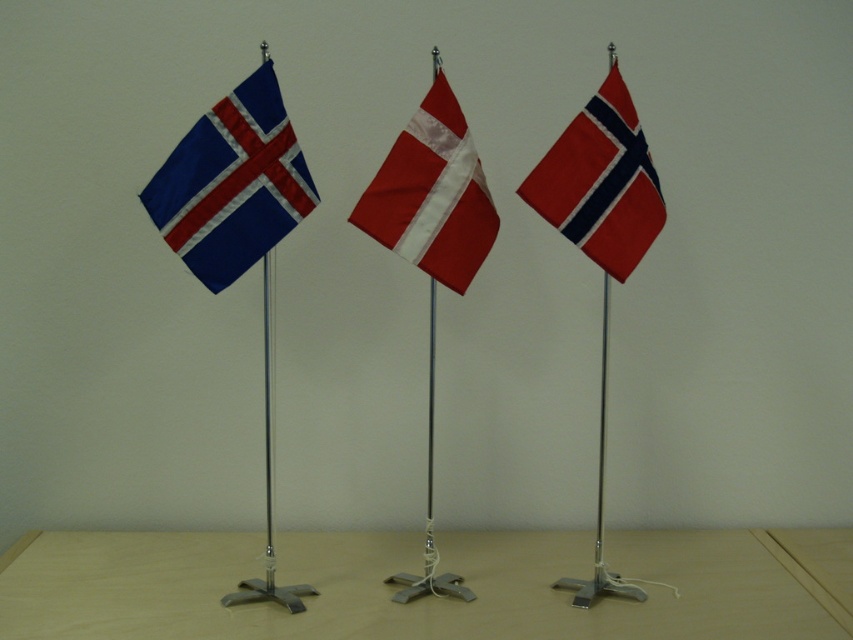
Question: Does wooden table at center come behind white glossy flag at center?

Choices:
 (A) yes
 (B) no

Answer: (B)

Question: Can you confirm if matte fabric flag at left is wider than white glossy flag at center?

Choices:
 (A) yes
 (B) no

Answer: (A)

Question: Which point appears closest to the camera in this image?

Choices:
 (A) (440, 81)
 (B) (355, 554)
 (C) (567, 156)

Answer: (C)

Question: Which point is closer to the camera?

Choices:
 (A) (296, 548)
 (B) (543, 164)
 (C) (311, 180)

Answer: (B)

Question: Is wooden table at center to the left of red fabric flag at center from the viewer's perspective?

Choices:
 (A) no
 (B) yes

Answer: (B)

Question: Which point is closer to the camera?

Choices:
 (A) (534, 611)
 (B) (473, 250)
 (C) (525, 198)
 (D) (207, 221)

Answer: (D)